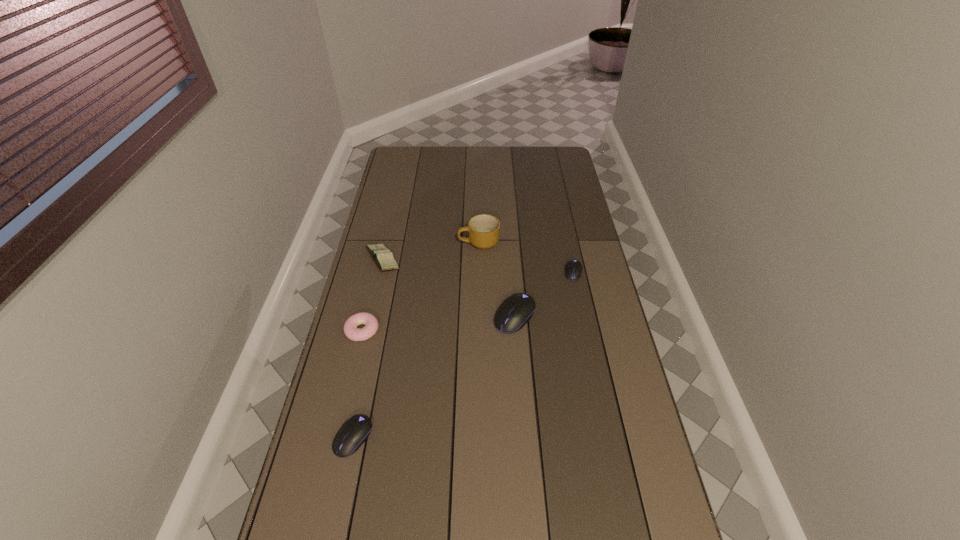
You are a GUI agent. You are given a task and a screenshot of the screen. Output one action in this format:
    pyautogui.click(x=<x>, y=<y>)
    Task: Click on the leftmost computer mouse
    Image resolution: width=960 pixels, height=540 pixels.
    Given the screenshot: What is the action you would take?
    pyautogui.click(x=354, y=432)

This screenshot has width=960, height=540. What are the coordinates of `the nearest computer mouse` in the screenshot? It's located at (354, 432).

The width and height of the screenshot is (960, 540). Identify the location of the second farthest computer mouse. (516, 310).

Image resolution: width=960 pixels, height=540 pixels. In order to click on the second computer mouse from left to right in this screenshot , I will do `click(516, 310)`.

Image resolution: width=960 pixels, height=540 pixels. Identify the location of the farthest computer mouse. (573, 272).

I want to click on the shortest computer mouse, so click(x=573, y=272).

Find the location of a particular element. diary is located at coordinates (383, 257).

Locate an element on the screen. The height and width of the screenshot is (540, 960). doughnut is located at coordinates (351, 331).

Where is `mug`? The image size is (960, 540). mug is located at coordinates (483, 230).

At what (x,y) coordinates should I click in order to perform the action: click on free space located 0.210m on the back of the nearest computer mouse. Please return your answer as a coordinate pair (x, y). The height and width of the screenshot is (540, 960). Looking at the image, I should click on pyautogui.click(x=371, y=356).